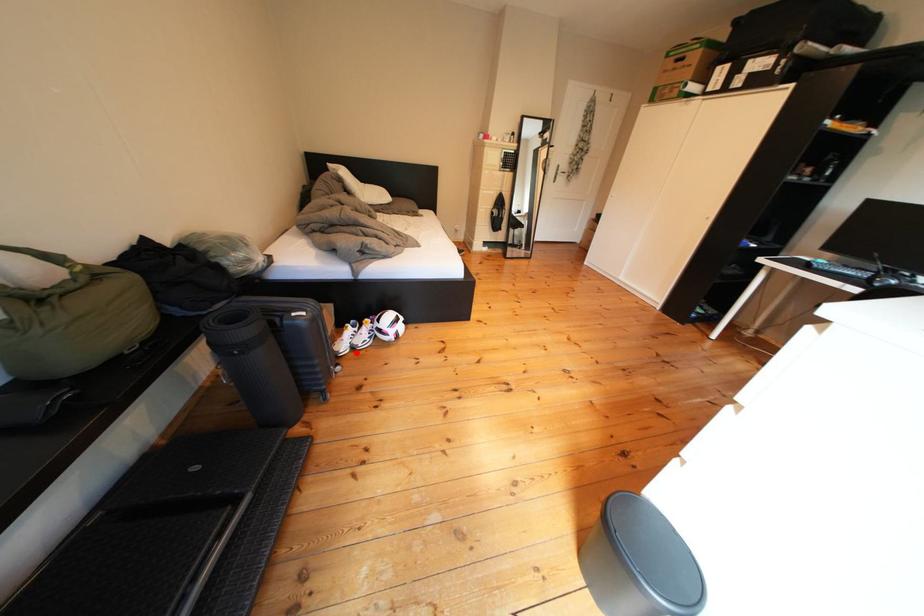
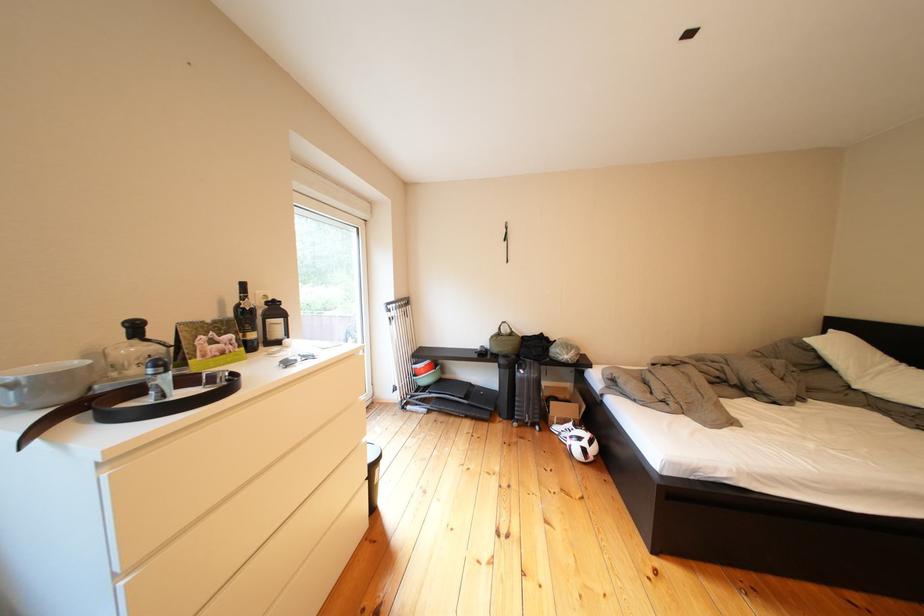
Question: I am providing you with two images of the same scene from different viewpoints. A red point is shown in image1. For the corresponding object point in image2, is it positioned nearer or farther from the camera?

Choices:
 (A) Nearer
 (B) Farther

Answer: (B)